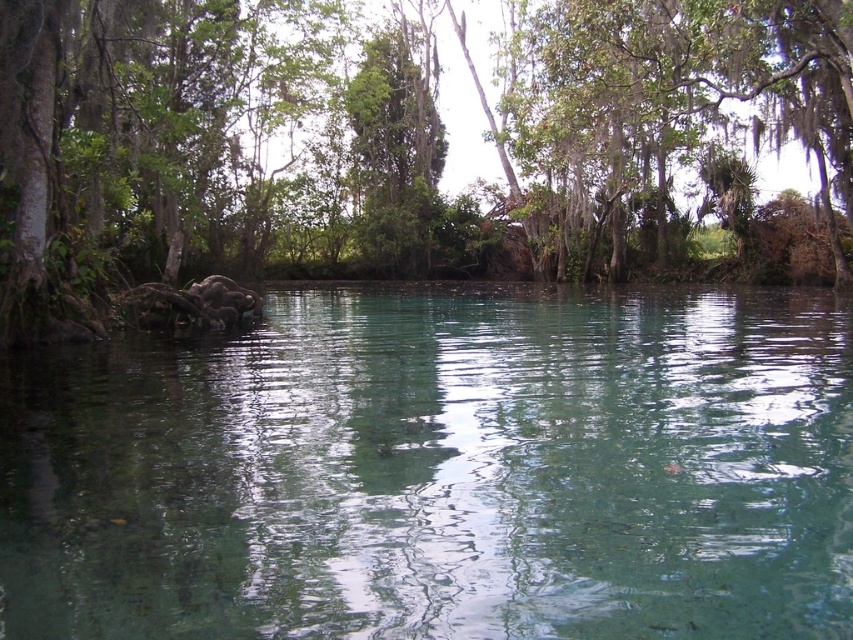
Does clear water at center have a greater height compared to green leafy tree at center?

In fact, clear water at center may be shorter than green leafy tree at center.

What do you see at coordinates (440, 472) in the screenshot?
I see `clear water at center` at bounding box center [440, 472].

Describe the element at coordinates (440, 472) in the screenshot. The image size is (853, 640). I see `clear water at center` at that location.

Find the location of a particular element. Image resolution: width=853 pixels, height=640 pixels. clear water at center is located at coordinates (440, 472).